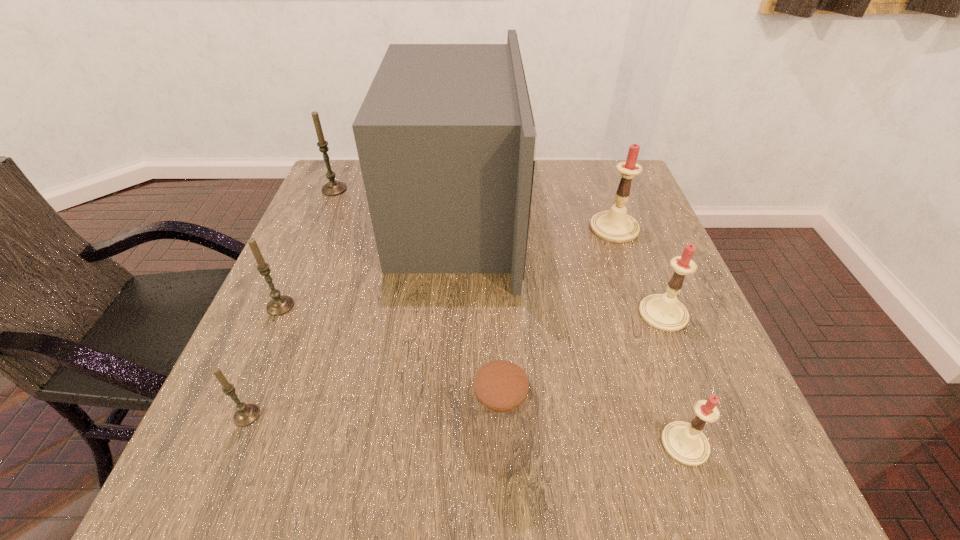
Where is `free space at the far right corner of the desktop`? This screenshot has width=960, height=540. free space at the far right corner of the desktop is located at coordinates (590, 204).

You are a GUI agent. You are given a task and a screenshot of the screen. Output one action in this format:
    pyautogui.click(x=<x>, y=<y>)
    Task: Click on the vacant space at the near right corner of the desktop
    
    Given the screenshot: What is the action you would take?
    pyautogui.click(x=679, y=477)

The width and height of the screenshot is (960, 540). In order to click on empty space that is in between the nearest gray candle and the jar in this screenshot , I will do `click(372, 430)`.

Find the location of a particular element. vacant space that is in between the smallest red candle and the tallest object is located at coordinates click(x=571, y=329).

The image size is (960, 540). I want to click on free space between the smallest red candle and the biggest red candle, so click(650, 336).

Find the location of a particular element. The image size is (960, 540). vacant space that is in between the second smallest gray candle and the brown jar is located at coordinates (389, 375).

Locate an element on the screen. The height and width of the screenshot is (540, 960). free space between the farthest red candle and the nearest red candle is located at coordinates (650, 336).

Where is `empty space between the jar and the biggest gray candle`? The width and height of the screenshot is (960, 540). empty space between the jar and the biggest gray candle is located at coordinates (416, 316).

Image resolution: width=960 pixels, height=540 pixels. I want to click on object that is the fifth nearest to the farthest gray candle, so click(499, 407).

Select which object is the sixth closest to the smallest gray candle. Please provide its 2D coordinates. Your answer should be formatted as a tuple, i.e. [(x, y)], where the tuple contains the x and y coordinates of a point satisfying the conditions above.

[(664, 312)]